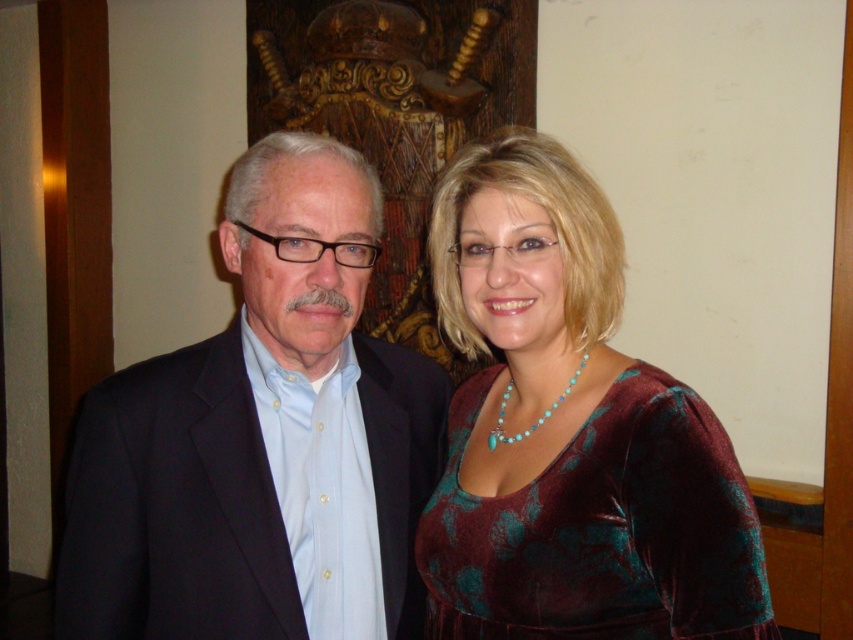
This screenshot has height=640, width=853. Describe the element at coordinates (260, 438) in the screenshot. I see `matte black suit at left` at that location.

Between point (231, 429) and point (619, 465), which one is positioned behind?

The point (231, 429) is more distant.

At what (x,y) coordinates should I click in order to perform the action: click on matte black suit at left. Please return your answer as a coordinate pair (x, y). The width and height of the screenshot is (853, 640). Looking at the image, I should click on (260, 438).